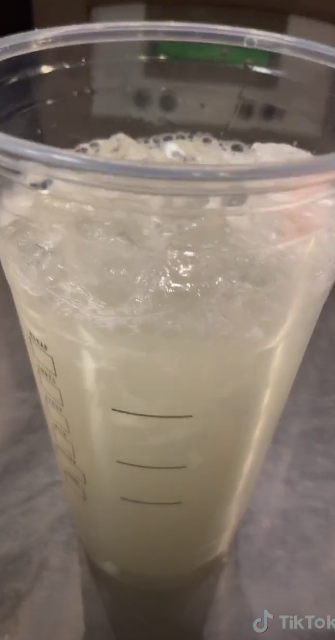
Where is `surface`? This screenshot has width=335, height=640. surface is located at coordinates (301, 491).